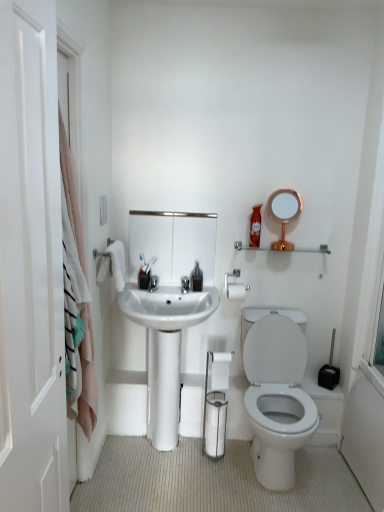
Question: Are rose gold metallic mirror at upper right, which is the second mirror from left to right, and pink fabric towel at left making contact?

Choices:
 (A) yes
 (B) no

Answer: (B)

Question: Is rose gold metallic mirror at upper right, acting as the 1th mirror starting from the right, behind pink fabric towel at left?

Choices:
 (A) no
 (B) yes

Answer: (B)

Question: Can you confirm if rose gold metallic mirror at upper right, acting as the 1th mirror starting from the right, is smaller than pink fabric towel at left?

Choices:
 (A) yes
 (B) no

Answer: (A)

Question: From a real-world perspective, is rose gold metallic mirror at upper right, acting as the 1th mirror starting from the right, below pink fabric towel at left?

Choices:
 (A) no
 (B) yes

Answer: (A)

Question: Are rose gold metallic mirror at upper right, which is the second mirror from left to right, and pink fabric towel at left located far from each other?

Choices:
 (A) no
 (B) yes

Answer: (B)

Question: Is point coord(24,30) positioned closer to the camera than point coord(329,250)?

Choices:
 (A) farther
 (B) closer

Answer: (B)

Question: Visually, is white matte door at left positioned to the left or to the right of clear glass shelf at upper center?

Choices:
 (A) left
 (B) right

Answer: (A)

Question: From a real-world perspective, is white matte door at left above or below clear glass shelf at upper center?

Choices:
 (A) above
 (B) below

Answer: (A)

Question: From the image's perspective, is white matte door at left positioned above or below clear glass shelf at upper center?

Choices:
 (A) below
 (B) above

Answer: (A)

Question: Considering the relative positions of white matte toilet paper at center and matte plastic soap dispenser at upper right, which appears as the 2th toiletry when viewed from the left, in the image provided, is white matte toilet paper at center to the left or to the right of matte plastic soap dispenser at upper right, which appears as the 2th toiletry when viewed from the left,?

Choices:
 (A) right
 (B) left

Answer: (B)

Question: Which is correct: white matte toilet paper at center is inside matte plastic soap dispenser at upper right, the first toiletry positioned from the right, or outside of it?

Choices:
 (A) outside
 (B) inside

Answer: (A)

Question: Relative to matte plastic soap dispenser at upper right, which appears as the 2th toiletry when viewed from the left, is white matte toilet paper at center in front or behind?

Choices:
 (A) front
 (B) behind

Answer: (A)

Question: In terms of width, does white matte toilet paper at center look wider or thinner when compared to matte plastic soap dispenser at upper right, arranged as the first toiletry when viewed from the top?

Choices:
 (A) wide
 (B) thin

Answer: (B)

Question: Considering the positions of point (215, 374) and point (160, 232), is point (215, 374) closer or farther from the camera than point (160, 232)?

Choices:
 (A) closer
 (B) farther

Answer: (A)

Question: In terms of height, does white matte toilet paper at center look taller or shorter compared to metallic rectangular mirror at center, which is the 1th mirror in left-to-right order?

Choices:
 (A) tall
 (B) short

Answer: (B)